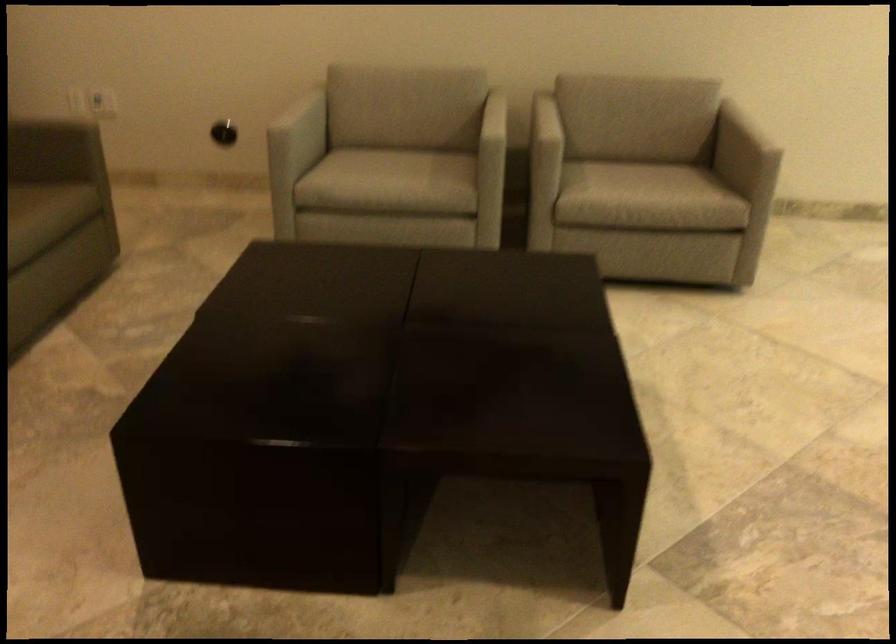
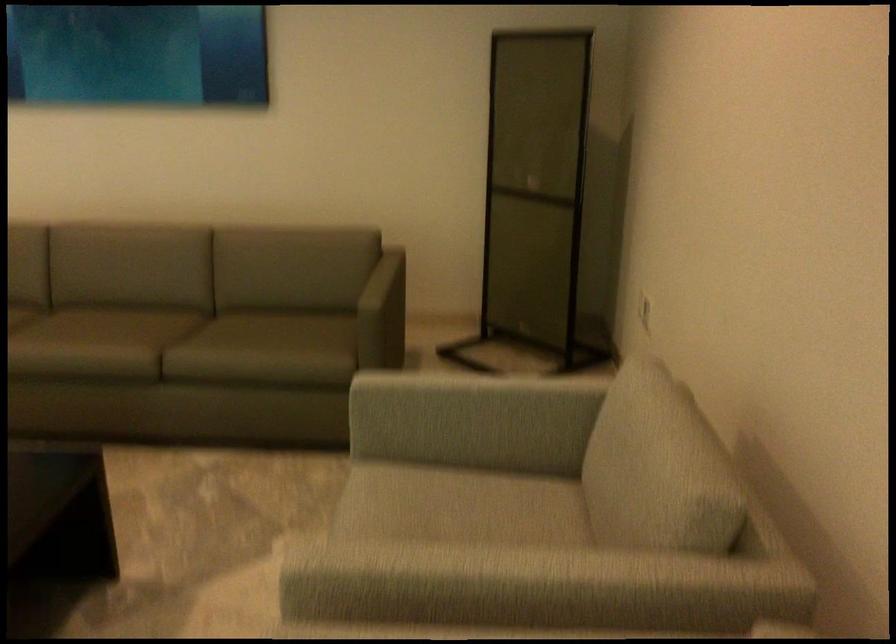
Locate, in the second image, the point that corresponds to pixel 485 109 in the first image.

(479, 573)